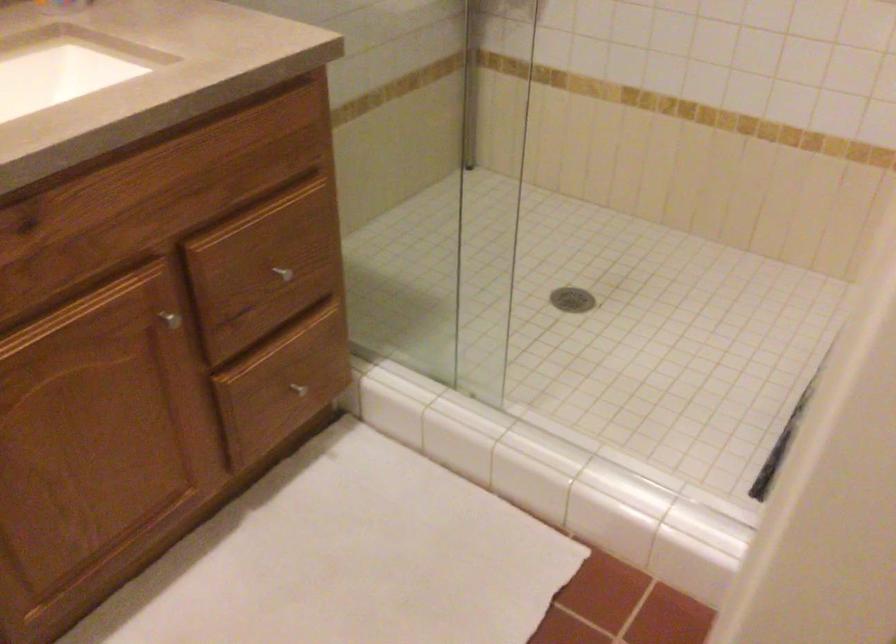
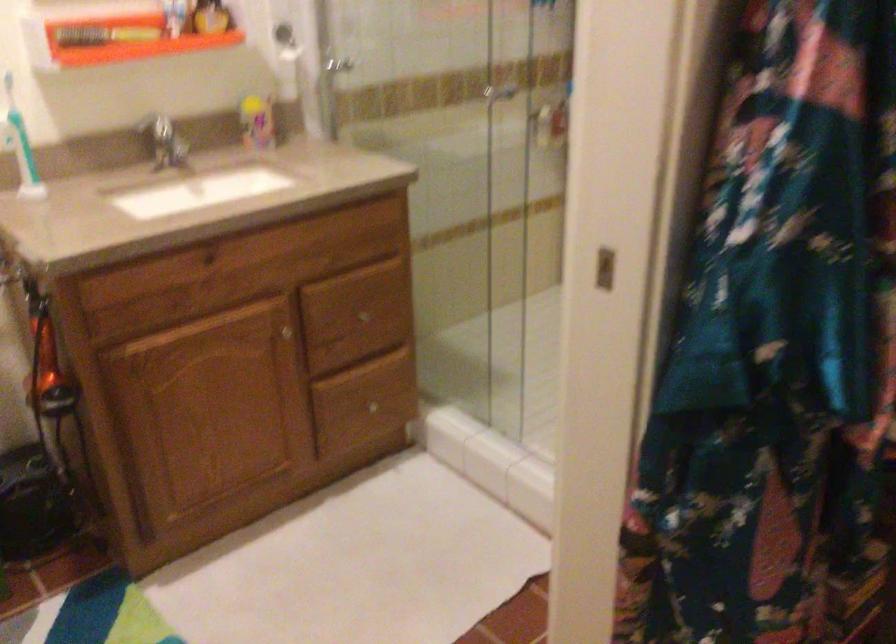
In a continuous first-person perspective shot, in which direction is the camera moving?

The movement direction of the cameraman is right, backward.